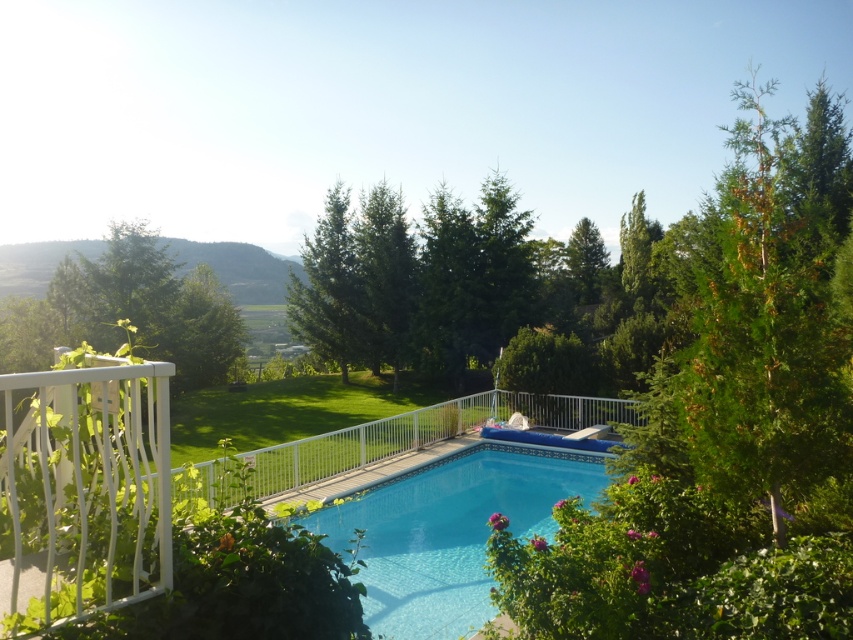
You are a lifeguard standing on the pool deck. You need to check if the white metal railing at center is positioned above the clear glass pool at center to ensure safety. Based on the scene, is the railing in a safe position?

Yes, the white metal railing at center is positioned above the clear glass pool at center, which is a safe placement as it provides a barrier around the pool area.

You are standing at point (635, 454) and want to walk to the pool deck. The pool deck is 7.86 meters away from your current position. Is there enough space to walk directly to the pool deck without crossing any obstacles?

Yes, there is enough space to walk directly to the pool deck from point (635, 454) since the distance is 7.86 meters and there are no obstacles mentioned in the scene description between the point and the pool deck.